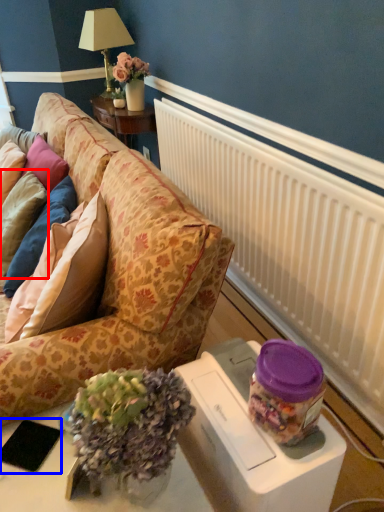
Question: Which object appears farthest to the camera in this image, pillow (highlighted by a red box) or pad (highlighted by a blue box)?

Choices:
 (A) pillow
 (B) pad

Answer: (A)